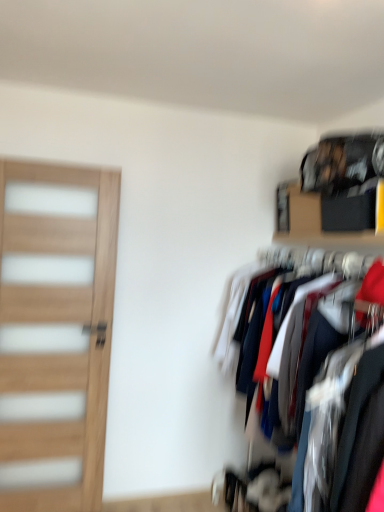
What do you see at coordinates (55, 332) in the screenshot? The height and width of the screenshot is (512, 384). I see `wooden door at left` at bounding box center [55, 332].

What are the coordinates of `wooden door at left` in the screenshot? It's located at (55, 332).

What do you see at coordinates (336, 192) in the screenshot? I see `wooden shelf at upper right` at bounding box center [336, 192].

Consider the image. Measure the distance between point (325, 145) and camera.

Point (325, 145) and camera are 2.06 meters apart from each other.

Locate an element on the screen. This screenshot has width=384, height=512. wooden shelf at upper right is located at coordinates (336, 192).

The image size is (384, 512). In order to click on wooden door at left in this screenshot , I will do `click(55, 332)`.

Is wooden door at left to the right of wooden shelf at upper right from the viewer's perspective?

No.

Between wooden door at left and wooden shelf at upper right, which one is positioned in front?

wooden shelf at upper right is closer to the camera.

Between point (26, 277) and point (300, 230), which one is positioned behind?

The point (300, 230) is farther from the camera.

Looking at this image, from the image's perspective, would you say wooden door at left is positioned over wooden shelf at upper right?

No, from the image's perspective, wooden door at left is not on top of wooden shelf at upper right.

From a real-world perspective, does wooden door at left sit lower than wooden shelf at upper right?

Indeed, from a real-world perspective, wooden door at left is positioned beneath wooden shelf at upper right.

Does wooden door at left have a greater width compared to wooden shelf at upper right?

Incorrect, the width of wooden door at left does not surpass that of wooden shelf at upper right.

Between wooden door at left and wooden shelf at upper right, which one has less height?

With less height is wooden shelf at upper right.

In terms of size, does wooden door at left appear bigger or smaller than wooden shelf at upper right?

In the image, wooden door at left appears to be larger than wooden shelf at upper right.

Is wooden door at left located outside wooden shelf at upper right?

wooden door at left lies outside wooden shelf at upper right's area.

Based on the photo, is wooden door at left touching wooden shelf at upper right?

No, wooden door at left is not beside wooden shelf at upper right.

Is wooden door at left positioned with its back to wooden shelf at upper right?

wooden door at left does not have its back to wooden shelf at upper right.

How many degrees apart are the facing directions of wooden door at left and wooden shelf at upper right?

91.5 degrees.

You are a GUI agent. You are given a task and a screenshot of the screen. Output one action in this format:
    pyautogui.click(x=<x>, y=<y>)
    Task: Click on the shelf in front of the wooden door at left
    The width and height of the screenshot is (384, 512).
    Given the screenshot: What is the action you would take?
    pyautogui.click(x=336, y=192)

Considering the positions of objects wooden shelf at upper right and wooden door at left in the image provided, who is more to the left, wooden shelf at upper right or wooden door at left?

From the viewer's perspective, wooden door at left appears more on the left side.

Which object is more forward, wooden shelf at upper right or wooden door at left?

wooden shelf at upper right is in front.

Which is nearer, (344, 217) or (22, 267)?

Positioned in front is point (344, 217).

From the image's perspective, does wooden shelf at upper right appear lower than wooden door at left?

Incorrect, from the image's perspective, wooden shelf at upper right is higher than wooden door at left.

From a real-world perspective, which is physically above, wooden shelf at upper right or wooden door at left?

From a 3D spatial view, wooden shelf at upper right is above.

Considering the relative sizes of wooden shelf at upper right and wooden door at left in the image provided, is wooden shelf at upper right wider than wooden door at left?

Indeed, wooden shelf at upper right has a greater width compared to wooden door at left.

Which of these two, wooden shelf at upper right or wooden door at left, stands taller?

With more height is wooden door at left.

Is wooden shelf at upper right smaller than wooden door at left?

Yes.

Based on the photo, would you say wooden shelf at upper right is inside or outside wooden door at left?

wooden shelf at upper right cannot be found inside wooden door at left.

Is wooden shelf at upper right not close to wooden door at left?

A: Yes, wooden shelf at upper right is far from wooden door at left.

Is wooden shelf at upper right aimed at wooden door at left?

No.

What's the angular difference between wooden shelf at upper right and wooden door at left's facing directions?

91.5 degrees.

Locate an element on the screen. door that appears below the wooden shelf at upper right (from the image's perspective) is located at coordinates (55, 332).

Locate an element on the screen. shelf that appears above the wooden door at left (from a real-world perspective) is located at coordinates (336, 192).

Locate an element on the screen. Image resolution: width=384 pixels, height=512 pixels. door on the left of the wooden shelf at upper right is located at coordinates (55, 332).